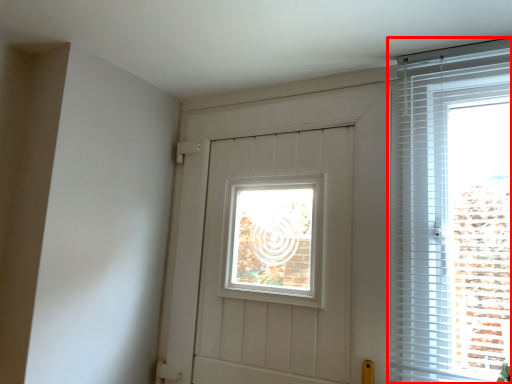
Question: From the image, what is the correct spatial relationship of window (annotated by the red box) in relation to door?

Choices:
 (A) right
 (B) left

Answer: (A)